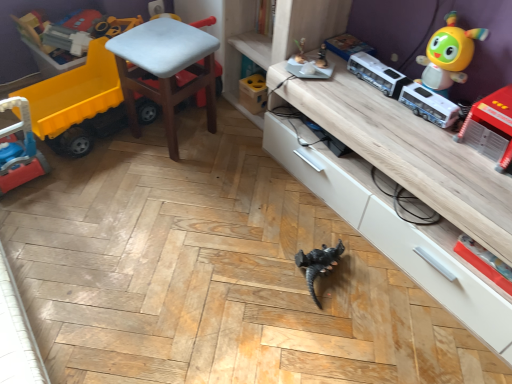
Where is `wooden block at center, placed as the 2th toy when sorted from left to right`? This screenshot has height=384, width=512. wooden block at center, placed as the 2th toy when sorted from left to right is located at coordinates (253, 93).

This screenshot has height=384, width=512. Describe the element at coordinates (78, 103) in the screenshot. I see `rubber yellow truck at left, the first toy viewed from the left` at that location.

Measure the distance between point (343, 71) and camera.

Point (343, 71) and camera are 1.67 meters apart from each other.

Locate an element on the screen. The width and height of the screenshot is (512, 384). shiny yellow toy at upper right, the second toy viewed from the right is located at coordinates (448, 55).

Find the location of a particular element. This screenshot has height=384, width=512. white plastic bus at upper right is located at coordinates (404, 90).

The image size is (512, 384). What do you see at coordinates (294, 29) in the screenshot? I see `wooden shelf at center` at bounding box center [294, 29].

Image resolution: width=512 pixels, height=384 pixels. I want to click on white plastic chair at center, so click(165, 70).

Considering the positions of objects rubber yellow truck at left, the first toy viewed from the left, and white plastic chair at center in the image provided, who is more to the left, rubber yellow truck at left, the first toy viewed from the left, or white plastic chair at center?

rubber yellow truck at left, the first toy viewed from the left.

Can you confirm if rubber yellow truck at left, the first toy viewed from the left, is bigger than white plastic chair at center?

Actually, rubber yellow truck at left, the first toy viewed from the left, might be smaller than white plastic chair at center.

Is rubber yellow truck at left, the first toy viewed from the left, facing away from white plastic chair at center?

No.

Which is farther, (287, 32) or (426, 83)?

The point (287, 32) is behind.

Consider the image. Between wooden shelf at center and shiny yellow toy at upper right, which appears as the fourth toy when viewed from the left, which one is positioned behind?

Positioned behind is wooden shelf at center.

From the image's perspective, is wooden shelf at center on shiny yellow toy at upper right, which appears as the fourth toy when viewed from the left?

Correct, wooden shelf at center appears higher than shiny yellow toy at upper right, which appears as the fourth toy when viewed from the left, in the image.

What's the angular difference between wooden shelf at center and shiny yellow toy at upper right, the second toy viewed from the right,'s facing directions?

They differ by 1.27 degrees in their facing directions.

Based on their sizes in the image, would you say matte blue book at upper center, the third toy positioned from the left, is bigger or smaller than wooden block at center, which is the fourth toy in right-to-left order?

matte blue book at upper center, the third toy positioned from the left, is smaller than wooden block at center, which is the fourth toy in right-to-left order.

From the image's perspective, is matte blue book at upper center, acting as the 3th toy starting from the right, below wooden block at center, placed as the 2th toy when sorted from left to right?

No.

Where is `toy above the wooden block at center, placed as the 2th toy when sorted from left to right (from the image's perspective)`? toy above the wooden block at center, placed as the 2th toy when sorted from left to right (from the image's perspective) is located at coordinates pos(347,46).

Considering the sizes of objects white plastic bus at upper right and red plastic fire truck at right, positioned as the fifth toy in left-to-right order, in the image provided, who is shorter, white plastic bus at upper right or red plastic fire truck at right, positioned as the fifth toy in left-to-right order,?

white plastic bus at upper right.

Where is `equipment located behind the red plastic fire truck at right, positioned as the fifth toy in left-to-right order`? The image size is (512, 384). equipment located behind the red plastic fire truck at right, positioned as the fifth toy in left-to-right order is located at coordinates (404, 90).

Looking at this image, choose the correct answer: Is white plastic bus at upper right inside red plastic fire truck at right, positioned as the fifth toy in left-to-right order, or outside it?

white plastic bus at upper right is not inside red plastic fire truck at right, positioned as the fifth toy in left-to-right order, it's outside.

From the image's perspective, which object appears higher, white plastic bus at upper right or red plastic fire truck at right, positioned as the first toy in right-to-left order?

white plastic bus at upper right, from the image's perspective.

Between wooden cabinet at lower center and shiny yellow toy at upper right, the second toy viewed from the right, which one appears on the right side from the viewer's perspective?

shiny yellow toy at upper right, the second toy viewed from the right.

Between wooden cabinet at lower center and shiny yellow toy at upper right, which appears as the fourth toy when viewed from the left, which one has larger size?

wooden cabinet at lower center is bigger.

In the scene shown: From the image's perspective, between wooden cabinet at lower center and shiny yellow toy at upper right, the second toy viewed from the right, who is located below?

wooden cabinet at lower center is shown below in the image.

Locate an element on the screen. The width and height of the screenshot is (512, 384). shelf located on the left of white plastic bus at upper right is located at coordinates (294, 29).

Considering the points (278, 25) and (429, 121), which point is behind, point (278, 25) or point (429, 121)?

Positioned behind is point (278, 25).

How many degrees apart are the facing directions of wooden shelf at center and white plastic bus at upper right?

0.00174 degrees.

Is wooden shelf at center outside of white plastic bus at upper right?

wooden shelf at center is positioned outside white plastic bus at upper right.

Considering the sizes of matte blue book at upper center, the third toy positioned from the left, and rubber yellow truck at left, which appears as the fifth toy when viewed from the right, in the image, is matte blue book at upper center, the third toy positioned from the left, taller or shorter than rubber yellow truck at left, which appears as the fifth toy when viewed from the right,?

In the image, matte blue book at upper center, the third toy positioned from the left, appears to be shorter than rubber yellow truck at left, which appears as the fifth toy when viewed from the right.

Which object is closer to the camera taking this photo, matte blue book at upper center, the third toy positioned from the left, or rubber yellow truck at left, the first toy viewed from the left?

rubber yellow truck at left, the first toy viewed from the left, is closer to the camera.

Is matte blue book at upper center, the third toy positioned from the left, at the left side of rubber yellow truck at left, which appears as the fifth toy when viewed from the right?

Incorrect, matte blue book at upper center, the third toy positioned from the left, is not on the left side of rubber yellow truck at left, which appears as the fifth toy when viewed from the right.

Locate an element on the screen. chair above the rubber yellow truck at left, the first toy viewed from the left (from a real-world perspective) is located at coordinates (165, 70).

The image size is (512, 384). I want to click on the 1st toy in front of the wooden shelf at center, so click(x=448, y=55).

Considering their positions, is wooden shelf at center positioned further to wooden cabinet at lower center than white plastic bus at upper right?

Among the two, wooden shelf at center is located further to wooden cabinet at lower center.

From the image, which object appears to be nearer to rubber yellow truck at left, which appears as the fifth toy when viewed from the right, wooden block at center, placed as the 2th toy when sorted from left to right, or wooden shelf at center?

Based on the image, wooden shelf at center appears to be nearer to rubber yellow truck at left, which appears as the fifth toy when viewed from the right.

Which object lies nearer to the anchor point wooden cabinet at lower center, wooden block at center, which is the fourth toy in right-to-left order, or shiny yellow toy at upper right, which appears as the fourth toy when viewed from the left?

shiny yellow toy at upper right, which appears as the fourth toy when viewed from the left, lies closer to wooden cabinet at lower center than the other object.

Based on their spatial positions, is shiny yellow toy at upper right, which appears as the fourth toy when viewed from the left, or wooden block at center, placed as the 2th toy when sorted from left to right, further from white plastic bus at upper right?

The object further to white plastic bus at upper right is wooden block at center, placed as the 2th toy when sorted from left to right.

Based on their spatial positions, is wooden shelf at center or white plastic bus at upper right closer to wooden block at center, placed as the 2th toy when sorted from left to right?

Based on the image, wooden shelf at center appears to be nearer to wooden block at center, placed as the 2th toy when sorted from left to right.

Considering their positions, is red plastic fire truck at right, positioned as the fifth toy in left-to-right order, positioned closer to shiny yellow toy at upper right, the second toy viewed from the right, than rubber yellow truck at left, which appears as the fifth toy when viewed from the right?

Based on the image, red plastic fire truck at right, positioned as the fifth toy in left-to-right order, appears to be nearer to shiny yellow toy at upper right, the second toy viewed from the right.

Based on their spatial positions, is wooden cabinet at lower center or shiny yellow toy at upper right, which appears as the fourth toy when viewed from the left, closer to white plastic bus at upper right?

shiny yellow toy at upper right, which appears as the fourth toy when viewed from the left.

Considering their positions, is shiny yellow toy at upper right, the second toy viewed from the right, positioned closer to wooden block at center, which is the fourth toy in right-to-left order, than wooden cabinet at lower center?

Among the two, wooden cabinet at lower center is located nearer to wooden block at center, which is the fourth toy in right-to-left order.

Where is `equipment located between white plastic chair at center and red plastic fire truck at right, positioned as the first toy in right-to-left order, in the left-right direction`? The width and height of the screenshot is (512, 384). equipment located between white plastic chair at center and red plastic fire truck at right, positioned as the first toy in right-to-left order, in the left-right direction is located at coordinates (404, 90).

Identify the location of shelf situated between rubber yellow truck at left, which appears as the fifth toy when viewed from the right, and wooden cabinet at lower center from left to right. This screenshot has height=384, width=512. (294, 29).

Locate an element on the screen. shelf between rubber yellow truck at left, the first toy viewed from the left, and shiny yellow toy at upper right, the second toy viewed from the right is located at coordinates (294, 29).

This screenshot has height=384, width=512. What are the coordinates of `chair situated between rubber yellow truck at left, which appears as the fifth toy when viewed from the right, and wooden cabinet at lower center from left to right` in the screenshot? It's located at (165, 70).